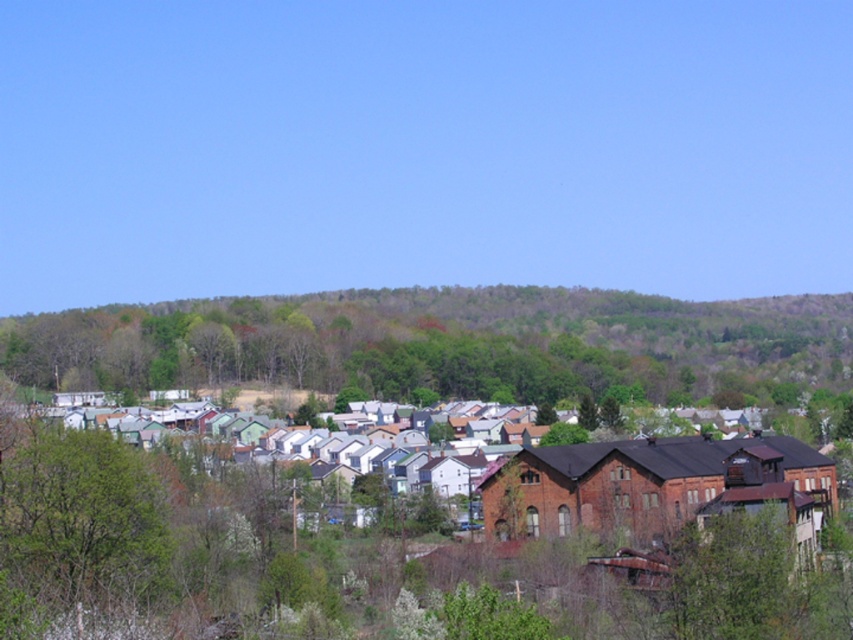
Which of these two, green leafy hillside at upper center or green leafy tree at lower left, stands taller?

Standing taller between the two is green leafy hillside at upper center.

Is green leafy hillside at upper center to the left of green leafy tree at lower left from the viewer's perspective?

Incorrect, green leafy hillside at upper center is not on the left side of green leafy tree at lower left.

I want to click on green leafy hillside at upper center, so click(434, 340).